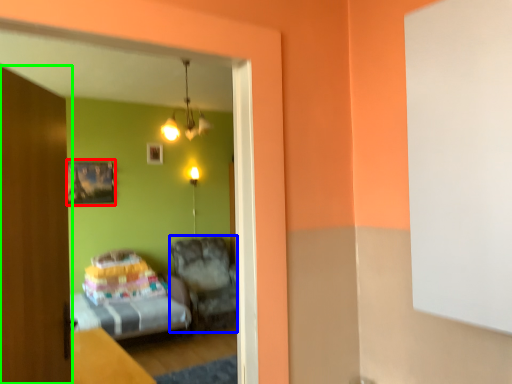
Question: Considering the real-world distances, which object is farthest from picture frame (highlighted by a red box)? furniture (highlighted by a blue box) or door (highlighted by a green box)?

Choices:
 (A) furniture
 (B) door

Answer: (B)